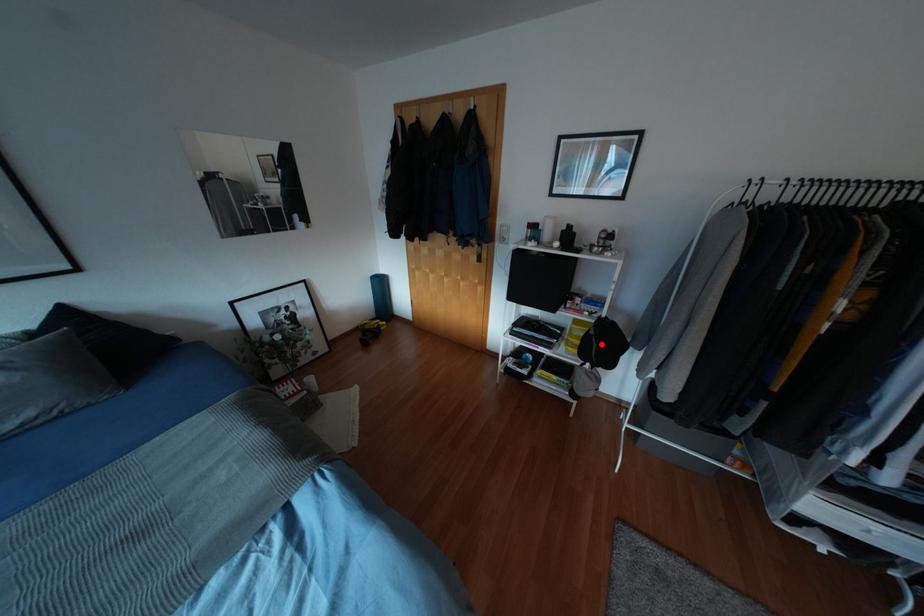
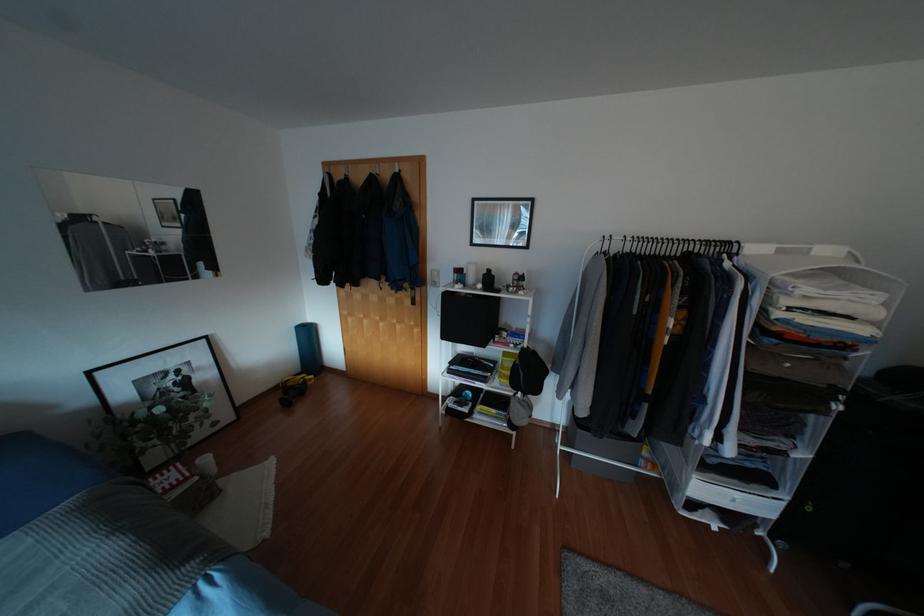
Question: I am providing you with two images of the same scene from different viewpoints. Image1 has a red point marked. In image2, the corresponding 3D location appears at what relative position? Reply with the corresponding letter.

Choices:
 (A) Closer
 (B) Farther

Answer: (B)